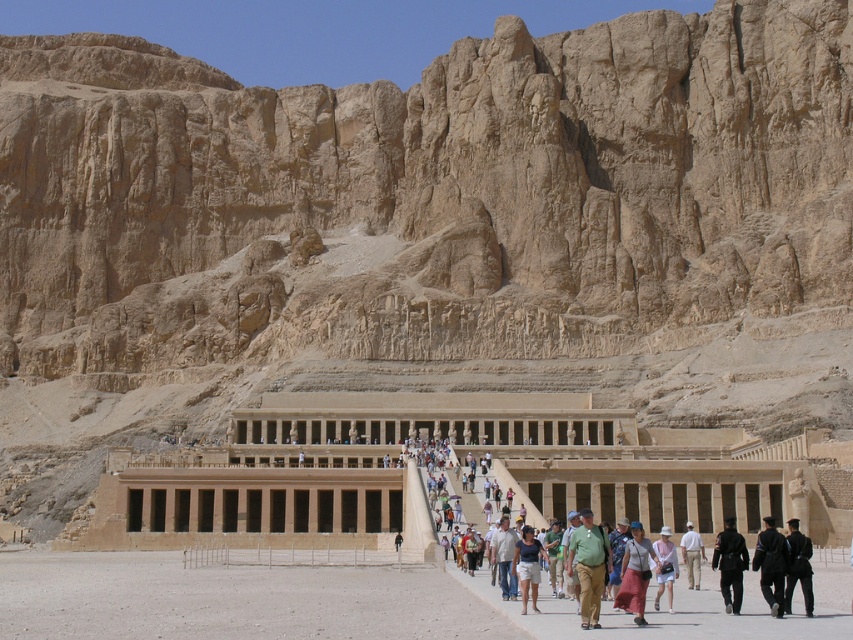
Question: Where is matte pink skirt at center located in relation to dark brown leather jacket at center in the image?

Choices:
 (A) right
 (B) left

Answer: (B)

Question: Is matte pink skirt at center below light brown cotton shirt at center?

Choices:
 (A) no
 (B) yes

Answer: (B)

Question: Among these points, which one is farthest from the camera?

Choices:
 (A) (637, 582)
 (B) (502, 566)

Answer: (B)

Question: Is light brown cotton shirt at center positioned at the back of light brown leather pants at center?

Choices:
 (A) yes
 (B) no

Answer: (B)

Question: Which point appears closest to the camera in this image?

Choices:
 (A) (793, 516)
 (B) (637, 577)

Answer: (B)

Question: Which point is closer to the camera?

Choices:
 (A) (691, 582)
 (B) (808, 540)

Answer: (B)